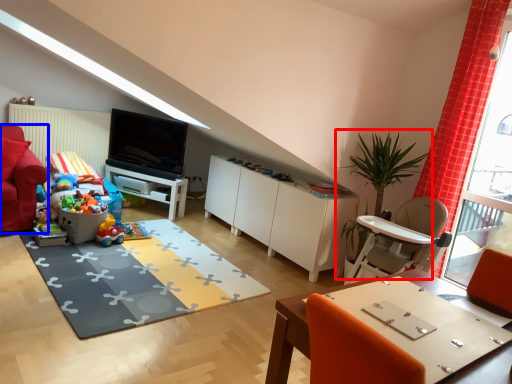
Question: Which of the following is the closest to the observer, houseplant (highlighted by a red box) or armchair (highlighted by a blue box)?

Choices:
 (A) houseplant
 (B) armchair

Answer: (A)